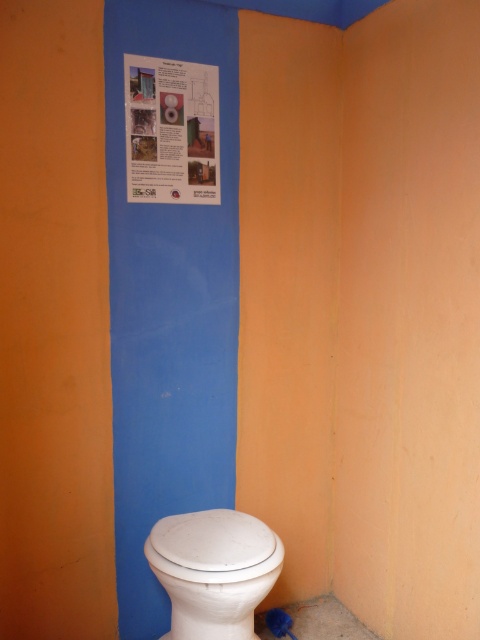
What do you see at coordinates (214, 570) in the screenshot? I see `white glossy toilet at lower right` at bounding box center [214, 570].

Locate an element on the screen. The width and height of the screenshot is (480, 640). white glossy toilet at lower right is located at coordinates (214, 570).

What do you see at coordinates (214, 570) in the screenshot? I see `white glossy toilet at lower right` at bounding box center [214, 570].

The height and width of the screenshot is (640, 480). What are the coordinates of `white glossy toilet at lower right` in the screenshot? It's located at (214, 570).